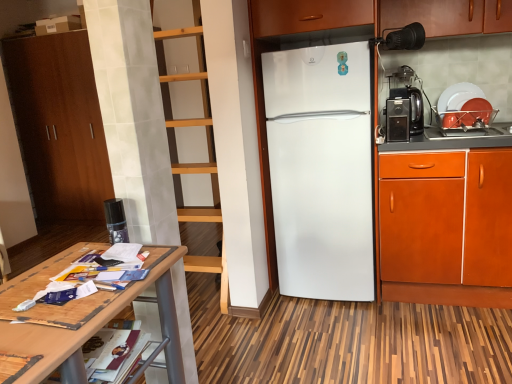
Question: In the image, is white matte refrigerator at center on the left side or the right side of black plastic toaster at right, the 2th appliance from the back?

Choices:
 (A) left
 (B) right

Answer: (A)

Question: Based on their sizes in the image, would you say white matte refrigerator at center is bigger or smaller than black plastic toaster at right, marked as the second appliance in a left-to-right arrangement?

Choices:
 (A) big
 (B) small

Answer: (A)

Question: Which object is the farthest from the black plastic coffee machine at right?

Choices:
 (A) white matte refrigerator at center
 (B) black plastic toaster at right, which appears as the 2th appliance when viewed from the right
 (C) brown wood cabinet at left, positioned as the first cabinetry in back-to-front order
 (D) wooden table at lower left
 (E) orange wood cabinet at right, arranged as the 1th cabinetry when viewed from the right

Answer: (C)

Question: Estimate the real-world distances between objects in this image. Which object is farther from the white matte refrigerator at center?

Choices:
 (A) white glossy plate at upper right, the third appliance in the left-to-right sequence
 (B) brown wood cabinet at left, acting as the first cabinetry starting from the left
 (C) black plastic toaster at right, which is the 2th appliance from bottom to top
 (D) black plastic coffee machine at right
 (E) orange wood cabinet at right, which is counted as the 2th cabinetry, starting from the left

Answer: (B)